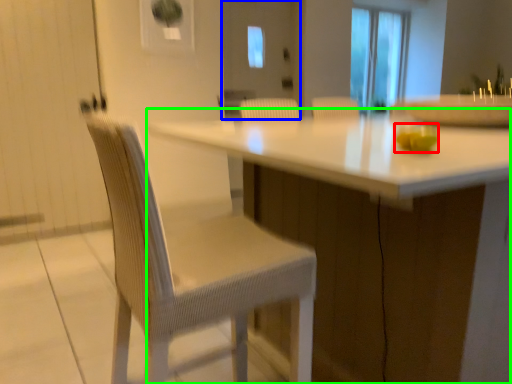
Question: Which object is positioned farthest from food (highlighted by a red box)? Select from screen door (highlighted by a blue box) and table (highlighted by a green box).

Choices:
 (A) screen door
 (B) table

Answer: (A)